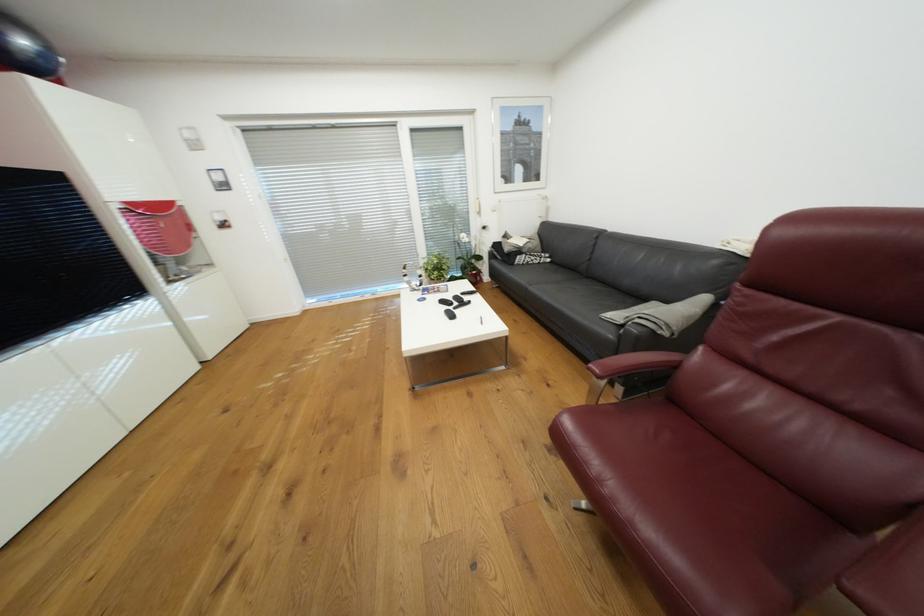
This screenshot has height=616, width=924. Identify the location of white pen. (480, 320).